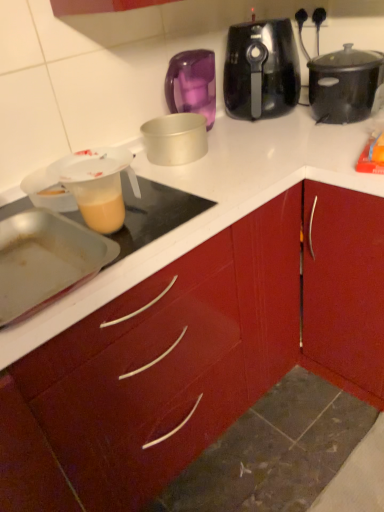
What are the coordinates of `unoccupied region to the right of translucent plastic measuring cup at left, marked as the 2th kitchen appliance in a front-to-back arrangement` in the screenshot? It's located at (179, 212).